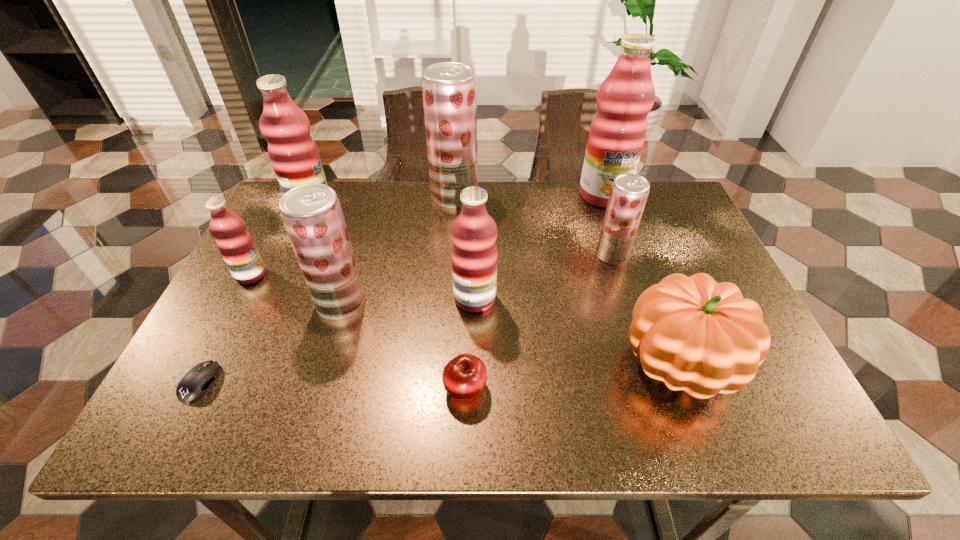
This screenshot has width=960, height=540. In order to click on the rightmost pink fruit juice in this screenshot , I will do coord(618,129).

Locate an element on the screen. The width and height of the screenshot is (960, 540). the biggest pink fruit juice is located at coordinates (618, 129).

The image size is (960, 540). Identify the location of the second strawberry fruit juice from right to left. tap(449, 89).

This screenshot has width=960, height=540. I want to click on the farthest strawberry fruit juice, so click(x=449, y=89).

Where is `the second biggest pink fruit juice`? the second biggest pink fruit juice is located at coordinates (294, 155).

Image resolution: width=960 pixels, height=540 pixels. In order to click on the fourth object from left to right in this screenshot , I will do `click(312, 215)`.

The width and height of the screenshot is (960, 540). Find the location of `the leftmost strawberry fruit juice`. the leftmost strawberry fruit juice is located at coordinates (312, 215).

This screenshot has width=960, height=540. What are the coordinates of `the third pink fruit juice from left to right` in the screenshot? It's located at [x=474, y=255].

At what (x,y) coordinates should I click in order to perform the action: click on the smallest pink fruit juice. Please return your answer as a coordinate pair (x, y). Looking at the image, I should click on (235, 244).

Image resolution: width=960 pixels, height=540 pixels. Find the location of `the second nearest strawberry fruit juice`. the second nearest strawberry fruit juice is located at coordinates (629, 192).